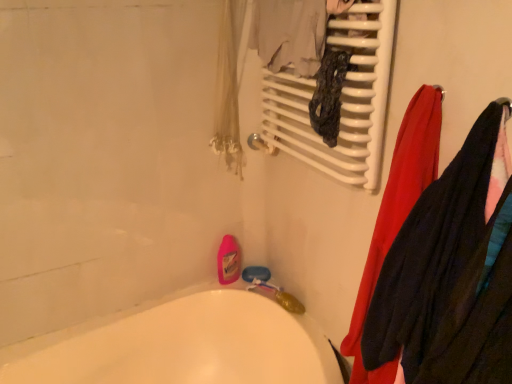
Question: Is point (300, 150) closer or farther from the camera than point (435, 114)?

Choices:
 (A) closer
 (B) farther

Answer: (B)

Question: Visually, is white glossy radiator at upper center positioned to the left or to the right of red fabric towel at right, the 2th clothing when ordered from right to left?

Choices:
 (A) left
 (B) right

Answer: (A)

Question: Estimate the real-world distances between objects in this image. Which object is farther from the white glossy radiator at upper center?

Choices:
 (A) white glossy bathtub at lower left
 (B) velvet-like black sweater at right, placed as the second clothing when sorted from left to right
 (C) red fabric towel at right, the 2th clothing when ordered from right to left

Answer: (A)

Question: Which is nearer to the white glossy radiator at upper center?

Choices:
 (A) red fabric towel at right, the 1th clothing in the left-to-right sequence
 (B) white glossy bathtub at lower left
 (C) velvet-like black sweater at right, which is the 1th clothing in right-to-left order

Answer: (A)